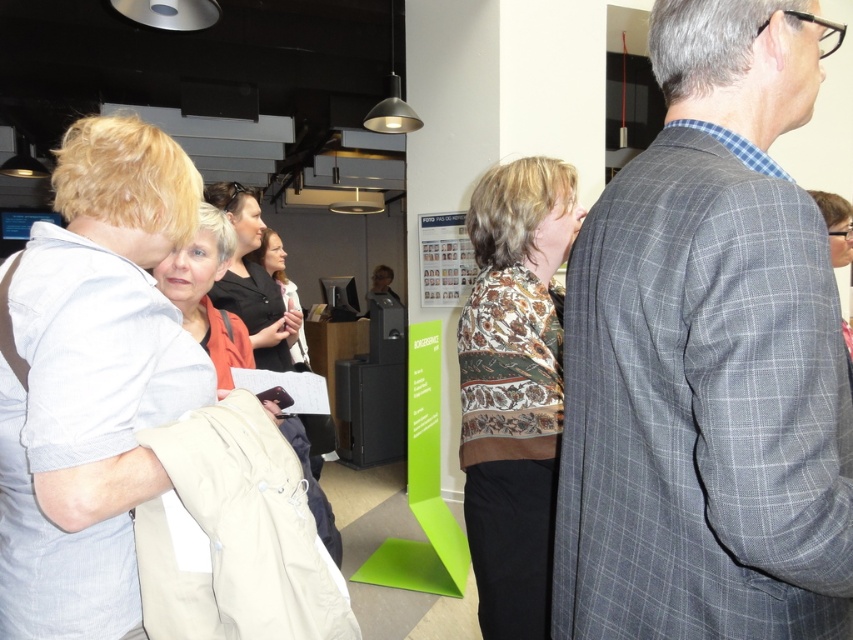
You are a photographer trying to capture a group photo of the gray checkered suit at right and the matte orange shirt at center. Since you want to ensure both subjects are in focus, which subject should you adjust your camera focus to prioritize based on their positions?

The gray checkered suit at right is shorter than the matte orange shirt at center, so you should prioritize focusing on the matte orange shirt at center to ensure both are in focus.

You are a photographer setting up for an event. You need to position a camera tripod so that both the gray checkered suit at right and the matte black laptop at center are in frame. Considering their heights, which object should you adjust the tripod height to focus on first?

The gray checkered suit at right has a greater height compared to the matte black laptop at center, so you should adjust the tripod height to focus on the gray checkered suit at right first to ensure both are in frame.

Looking at the scene described, which object is positioned to the right of the other between the printed fabric blouse at center and the matte beige coat at center?

The printed fabric blouse at center is to the right of the matte beige coat at center.